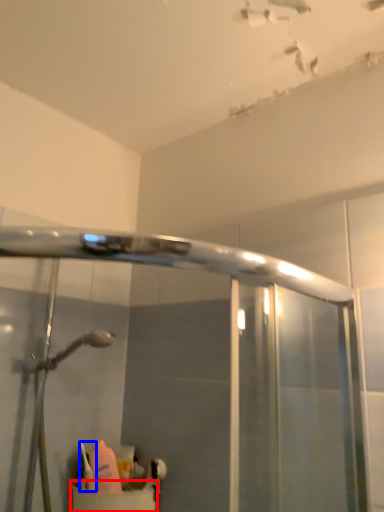
Question: Which object is further to the camera taking this photo, sink (highlighted by a red box) or toiletry (highlighted by a blue box)?

Choices:
 (A) sink
 (B) toiletry

Answer: (B)